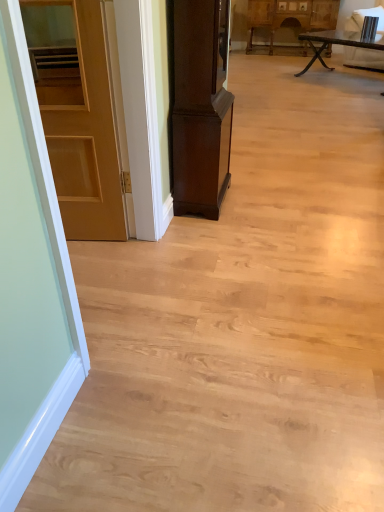
Question: Should I look upward or downward to see dark wood cabinet at center, arranged as the first cabinetry when viewed from the front?

Choices:
 (A) down
 (B) up

Answer: (B)

Question: Considering the relative sizes of wooden carved cabinet at upper center, the 1th cabinetry positioned from the right, and dark wood cabinet at center, acting as the 1th cabinetry starting from the bottom, in the image provided, is wooden carved cabinet at upper center, the 1th cabinetry positioned from the right, wider than dark wood cabinet at center, acting as the 1th cabinetry starting from the bottom,?

Choices:
 (A) yes
 (B) no

Answer: (A)

Question: From the image's perspective, is wooden carved cabinet at upper center, the 1th cabinetry positioned from the right, located above dark wood cabinet at center, arranged as the first cabinetry when viewed from the front?

Choices:
 (A) yes
 (B) no

Answer: (A)

Question: Is wooden carved cabinet at upper center, acting as the first cabinetry starting from the back, closer to the viewer compared to dark wood cabinet at center, the 2th cabinetry when ordered from right to left?

Choices:
 (A) yes
 (B) no

Answer: (B)

Question: Is wooden carved cabinet at upper center, which is the second cabinetry from front to back, taller than dark wood cabinet at center, arranged as the first cabinetry when viewed from the front?

Choices:
 (A) yes
 (B) no

Answer: (B)

Question: From a real-world perspective, is wooden carved cabinet at upper center, the 1th cabinetry positioned from the right, positioned under dark wood cabinet at center, arranged as the first cabinetry when viewed from the front, based on gravity?

Choices:
 (A) yes
 (B) no

Answer: (A)

Question: Is wooden carved cabinet at upper center, which is the second cabinetry from front to back, behind dark wood cabinet at center, the first cabinetry when ordered from left to right?

Choices:
 (A) no
 (B) yes

Answer: (B)

Question: From a real-world perspective, does dark wood cabinet at center, the second cabinetry positioned from the back, sit lower than wooden carved cabinet at upper center, which is the second cabinetry from front to back?

Choices:
 (A) yes
 (B) no

Answer: (B)

Question: Considering the relative sizes of dark wood cabinet at center, the second cabinetry positioned from the back, and wooden carved cabinet at upper center, the 1th cabinetry positioned from the right, in the image provided, is dark wood cabinet at center, the second cabinetry positioned from the back, smaller than wooden carved cabinet at upper center, the 1th cabinetry positioned from the right,?

Choices:
 (A) yes
 (B) no

Answer: (A)

Question: From the image's perspective, is dark wood cabinet at center, acting as the 2th cabinetry starting from the top, on top of wooden carved cabinet at upper center, the 1th cabinetry positioned from the right?

Choices:
 (A) no
 (B) yes

Answer: (A)

Question: Considering the relative sizes of dark wood cabinet at center, the first cabinetry when ordered from left to right, and wooden carved cabinet at upper center, the 1th cabinetry positioned from the right, in the image provided, is dark wood cabinet at center, the first cabinetry when ordered from left to right, wider than wooden carved cabinet at upper center, the 1th cabinetry positioned from the right,?

Choices:
 (A) no
 (B) yes

Answer: (A)

Question: Is dark wood cabinet at center, acting as the 1th cabinetry starting from the bottom, at the right side of wooden carved cabinet at upper center, which appears as the 2th cabinetry when viewed from the left?

Choices:
 (A) yes
 (B) no

Answer: (B)

Question: Could you tell me if dark wood cabinet at center, the 2th cabinetry when ordered from right to left, is turned towards wooden carved cabinet at upper center, acting as the first cabinetry starting from the back?

Choices:
 (A) yes
 (B) no

Answer: (B)

Question: Is wooden rustic table at upper right bigger than dark wood cabinet at center, acting as the 1th cabinetry starting from the bottom?

Choices:
 (A) no
 (B) yes

Answer: (B)